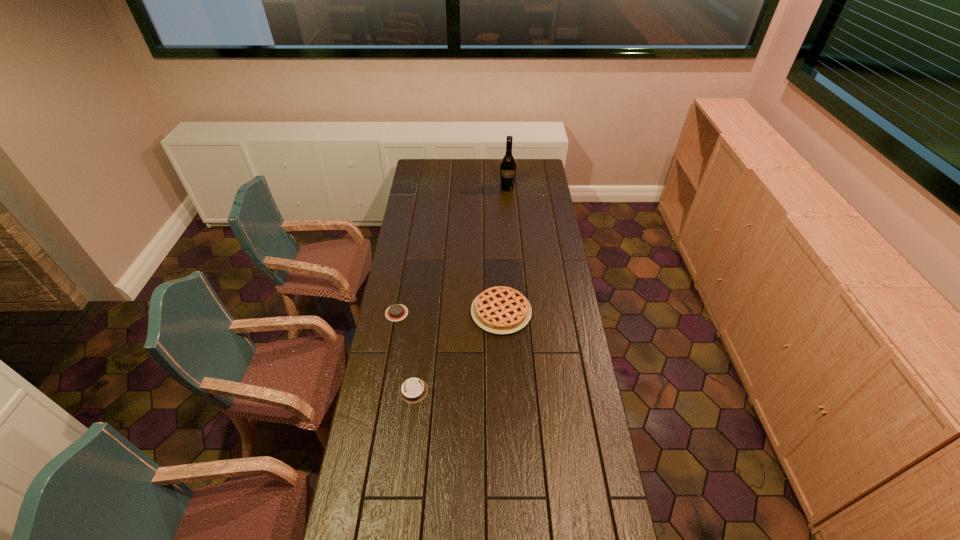
What are the coordinates of `the tallest object` in the screenshot? It's located at (508, 164).

Identify the location of the farthest object. This screenshot has height=540, width=960. (508, 164).

Find the location of a particular element. The image size is (960, 540). pie is located at coordinates (502, 310).

The image size is (960, 540). I want to click on the second object from left to right, so click(x=413, y=390).

Locate an element on the screen. Image resolution: width=960 pixels, height=540 pixels. the nearest object is located at coordinates (413, 390).

At what (x,y) coordinates should I click in order to perform the action: click on the leftmost object. Please return your answer as a coordinate pair (x, y). The height and width of the screenshot is (540, 960). Looking at the image, I should click on (397, 312).

This screenshot has width=960, height=540. I want to click on the left chocolate cake, so click(x=397, y=312).

Find the location of `free space located 0.220m on the label of the wine bottle`. free space located 0.220m on the label of the wine bottle is located at coordinates (509, 214).

The image size is (960, 540). Identify the location of free space located 0.280m on the back of the second tallest object. (498, 251).

This screenshot has width=960, height=540. In order to click on free space located 0.060m on the left of the nearer chocolate cake in this screenshot , I will do `click(384, 390)`.